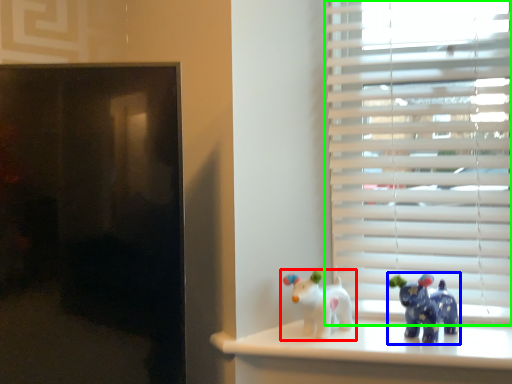
Question: Which object is positioned closest to toy (highlighted by a red box)? Select from toy (highlighted by a blue box) and window blind (highlighted by a green box).

Choices:
 (A) toy
 (B) window blind

Answer: (A)